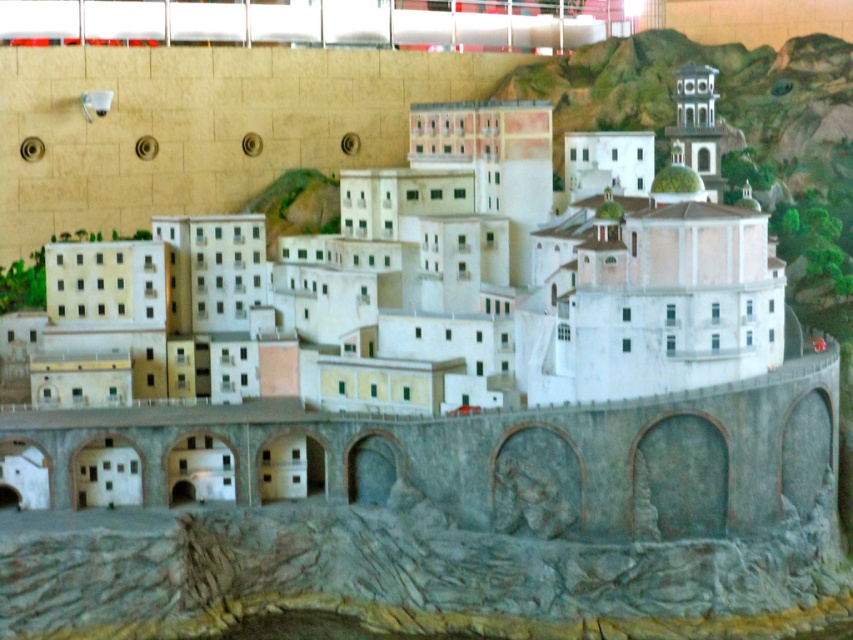
You are a visitor approaching the stone arch bridge at center in the historical model town. Which direction should you turn to find the white matte building at center?

The white matte building at center is positioned on the left side of the stone arch bridge at center, so you should turn left to find it.

You are standing in front of the miniature historical town model. There are two points marked on the model at coordinates point [277,259] and point [682,422]. Which point is closer to your viewpoint?

Point [277,259] is further to the camera than point [682,422], so the point closer to your viewpoint is point [682,422].